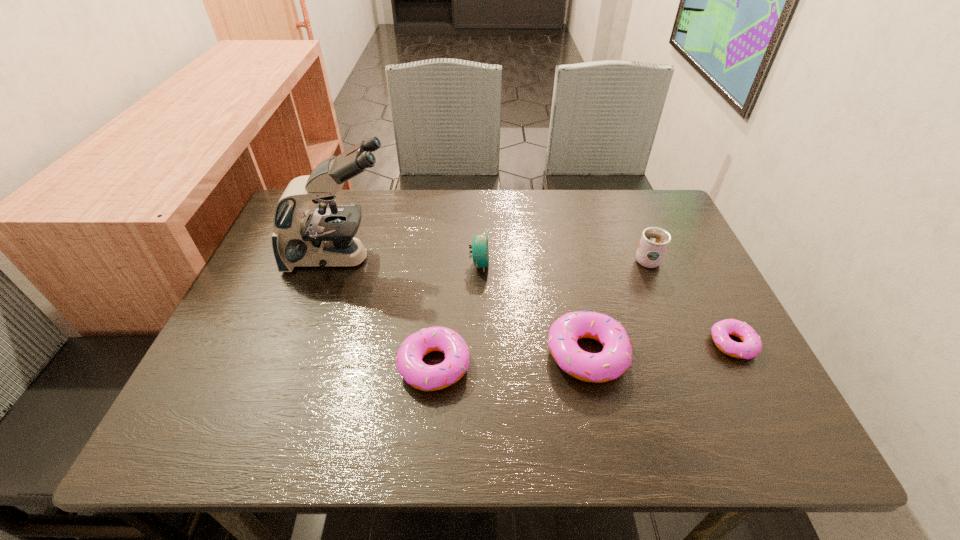
You are a GUI agent. You are given a task and a screenshot of the screen. Output one action in this format:
    pyautogui.click(x=<x>, y=<y>)
    Task: Click on the unoccupied position between the third tallest object and the microscope
    This screenshot has height=540, width=960.
    Given the screenshot: What is the action you would take?
    pyautogui.click(x=410, y=261)

Identify the location of vacant area that lies between the rightmost doughnut and the fourth object from left to right. This screenshot has width=960, height=540. 660,349.

Find the location of a particular element. Image resolution: width=960 pixels, height=540 pixels. free space between the rightmost doughnut and the fourth shortest object is located at coordinates (606, 304).

You are a GUI agent. You are given a task and a screenshot of the screen. Output one action in this format:
    pyautogui.click(x=<x>, y=<y>)
    Task: Click on the vacant space that is in between the second doughnut from right to left and the microscope
    Image resolution: width=960 pixels, height=540 pixels.
    Given the screenshot: What is the action you would take?
    pyautogui.click(x=464, y=306)

Locate an element on the screen. The width and height of the screenshot is (960, 540). unoccupied position between the tallest object and the shortest object is located at coordinates (538, 301).

Where is `vacant space in between the fifth object from left to right and the second doughnut from right to left`? The image size is (960, 540). vacant space in between the fifth object from left to right and the second doughnut from right to left is located at coordinates (616, 307).

The image size is (960, 540). Find the location of `free area in between the second shortest object and the third tallest object`. free area in between the second shortest object and the third tallest object is located at coordinates (457, 315).

This screenshot has width=960, height=540. In order to click on free spot between the second object from right to left and the leftmost doughnut in this screenshot , I will do `click(540, 312)`.

Select which object appears as the second closest to the fifth shortest object. Please provide its 2D coordinates. Your answer should be formatted as a tuple, i.e. [(x, y)], where the tuple contains the x and y coordinates of a point satisfying the conditions above.

[(615, 358)]

Locate which object ranks fifth in proximity to the microscope. Please provide its 2D coordinates. Your answer should be formatted as a tuple, i.e. [(x, y)], where the tuple contains the x and y coordinates of a point satisfying the conditions above.

[(752, 345)]